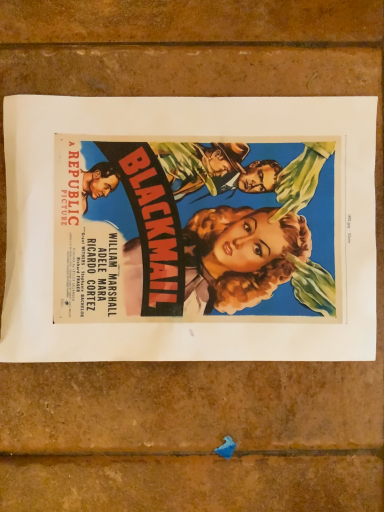
What is the approximate height of vibrant paper poster at center?

It is 0.60 inches.

Measure the distance between vibrant paper poster at center and camera.

The distance of vibrant paper poster at center from camera is 13.00 inches.

This screenshot has width=384, height=512. Describe the element at coordinates (189, 229) in the screenshot. I see `vibrant paper poster at center` at that location.

The image size is (384, 512). Identify the location of vibrant paper poster at center. (189, 229).

Image resolution: width=384 pixels, height=512 pixels. What are the coordinates of `vibrant paper poster at center` in the screenshot? It's located at (189, 229).